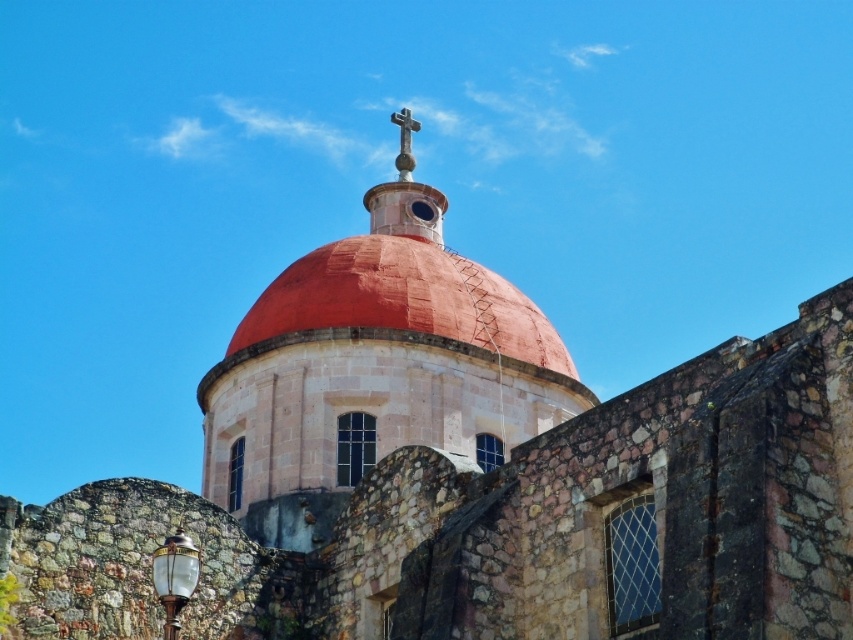
What do you see at coordinates (374, 369) in the screenshot? This screenshot has height=640, width=853. I see `smooth terracotta dome at center` at bounding box center [374, 369].

Locate an element on the screen. smooth terracotta dome at center is located at coordinates (374, 369).